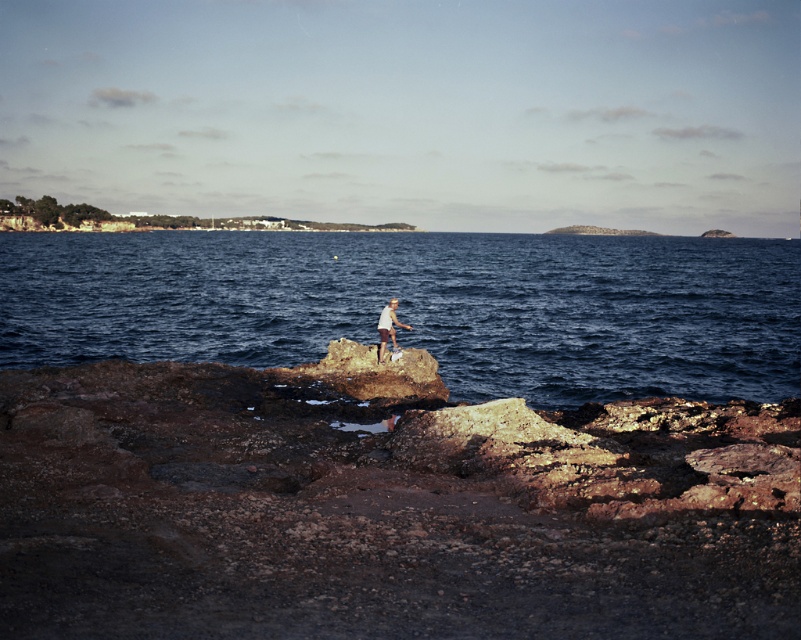
Question: Does rusty rock at center lie behind blue water at center?

Choices:
 (A) yes
 (B) no

Answer: (B)

Question: Can you confirm if rusty rock at center is positioned below blue water at center?

Choices:
 (A) yes
 (B) no

Answer: (A)

Question: Is rusty rock at center positioned in front of white cotton shirt at center?

Choices:
 (A) no
 (B) yes

Answer: (B)

Question: Which object appears closest to the camera in this image?

Choices:
 (A) blue water at center
 (B) white cotton shirt at center

Answer: (B)

Question: Estimate the real-world distances between objects in this image. Which object is closer to the rusty rock at center?

Choices:
 (A) blue water at center
 (B) white cotton shirt at center

Answer: (B)

Question: Among these objects, which one is farthest from the camera?

Choices:
 (A) blue water at center
 (B) white cotton shirt at center

Answer: (A)